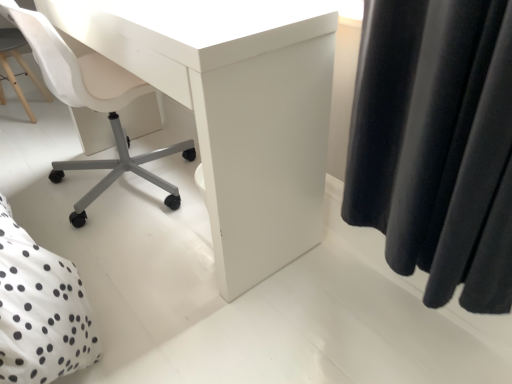
At what (x,y) coordinates should I click in order to perform the action: click on white plastic chair at lower left. Please return your answer as a coordinate pair (x, y). Looking at the image, I should click on (93, 105).

Which object is wider, white plastic chair at lower left or white matte desk at center?

white plastic chair at lower left is wider.

At what (x,y) coordinates should I click in order to perform the action: click on desk positioned vertically above the white plastic chair at lower left (from a real-world perspective). Please return your answer as a coordinate pair (x, y). The height and width of the screenshot is (384, 512). Looking at the image, I should click on (234, 109).

Is white plastic chair at lower left outside of white matte desk at center?

No, white plastic chair at lower left is inside white matte desk at center's boundary.

Can you confirm if white plastic chair at lower left is smaller than white matte desk at center?

Yes, white plastic chair at lower left is smaller than white matte desk at center.

Does white plastic chair at lower left have a greater width compared to white dotted fabric at lower left?

Incorrect, the width of white plastic chair at lower left does not surpass that of white dotted fabric at lower left.

Is white plastic chair at lower left facing towards white dotted fabric at lower left?

No.

From a real-world perspective, who is located lower, white plastic chair at lower left or white dotted fabric at lower left?

white plastic chair at lower left, from a real-world perspective.

You are a GUI agent. You are given a task and a screenshot of the screen. Output one action in this format:
    pyautogui.click(x=<x>, y=<y>)
    Task: Click on the chair on the right of white dotted fabric at lower left
    
    Given the screenshot: What is the action you would take?
    pyautogui.click(x=93, y=105)

From the image's perspective, which is below, white matte desk at center or white dotted fabric at lower left?

From the image's view, white dotted fabric at lower left is below.

Is white dotted fabric at lower left at the back of white matte desk at center?

Yes, white matte desk at center's orientation is away from white dotted fabric at lower left.

From a real-world perspective, is white matte desk at center physically located above or below white dotted fabric at lower left?

In terms of real-world spatial position, white matte desk at center is below white dotted fabric at lower left.

Which object is positioned more to the left, white matte desk at center or white dotted fabric at lower left?

Positioned to the left is white dotted fabric at lower left.

Looking at their sizes, would you say white dotted fabric at lower left is wider or thinner than white matte desk at center?

In the image, white dotted fabric at lower left appears to be wider than white matte desk at center.

Is white dotted fabric at lower left far away from white matte desk at center?

No, white dotted fabric at lower left is not far from white matte desk at center.

Considering the sizes of white dotted fabric at lower left and white matte desk at center in the image, is white dotted fabric at lower left bigger or smaller than white matte desk at center?

In the image, white dotted fabric at lower left appears to be smaller than white matte desk at center.

Is white dotted fabric at lower left smaller than white plastic chair at lower left?

Correct, white dotted fabric at lower left occupies less space than white plastic chair at lower left.

Between white dotted fabric at lower left and white plastic chair at lower left, which one has more height?

With more height is white dotted fabric at lower left.

Is white plastic chair at lower left a part of white dotted fabric at lower left?

That's incorrect, white plastic chair at lower left is not inside white dotted fabric at lower left.

Is white matte desk at center in front of or behind white plastic chair at lower left in the image?

In the image, white matte desk at center appears in front of white plastic chair at lower left.

The width and height of the screenshot is (512, 384). Find the location of `desk above the white plastic chair at lower left (from a real-world perspective)`. desk above the white plastic chair at lower left (from a real-world perspective) is located at coordinates (234, 109).

Is white matte desk at center positioned beyond the bounds of white plastic chair at lower left?

No, white matte desk at center is inside white plastic chair at lower left's boundary.

Where is `chair behind the white matte desk at center`? The height and width of the screenshot is (384, 512). chair behind the white matte desk at center is located at coordinates coord(93,105).

Locate an element on the screen. This screenshot has height=384, width=512. bed above the white plastic chair at lower left (from a real-world perspective) is located at coordinates (40, 310).

Estimate the real-world distances between objects in this image. Which object is further from white dotted fabric at lower left, white matte desk at center or white plastic chair at lower left?

A: white plastic chair at lower left lies further to white dotted fabric at lower left than the other object.

When comparing their distances from white plastic chair at lower left, does white dotted fabric at lower left or white matte desk at center seem further?

Based on the image, white dotted fabric at lower left appears to be further to white plastic chair at lower left.

When comparing their distances from white dotted fabric at lower left, does white plastic chair at lower left or white matte desk at center seem closer?

white matte desk at center is closer to white dotted fabric at lower left.

Looking at the image, which one is located further to white plastic chair at lower left, white matte desk at center or white dotted fabric at lower left?

The object further to white plastic chair at lower left is white dotted fabric at lower left.

Considering their positions, is white dotted fabric at lower left positioned closer to white matte desk at center than white plastic chair at lower left?

The object closer to white matte desk at center is white plastic chair at lower left.

Looking at the image, which one is located closer to white matte desk at center, white plastic chair at lower left or white dotted fabric at lower left?

The object closer to white matte desk at center is white plastic chair at lower left.

Find the location of a particular element. This screenshot has width=512, height=384. chair located between white dotted fabric at lower left and white matte desk at center in the left-right direction is located at coordinates (93, 105).